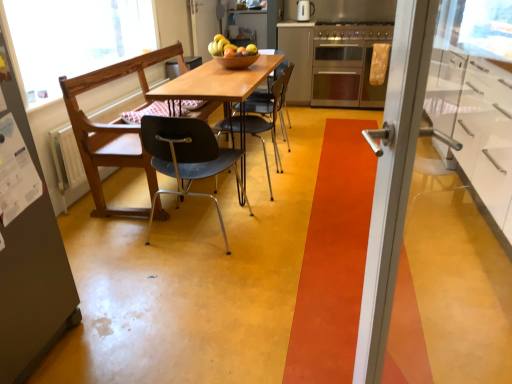
Image resolution: width=512 pixels, height=384 pixels. What are the coordinates of `free space to the right of wooden chair at center, the 2th chair when ordered from front to back` in the screenshot? It's located at (329, 163).